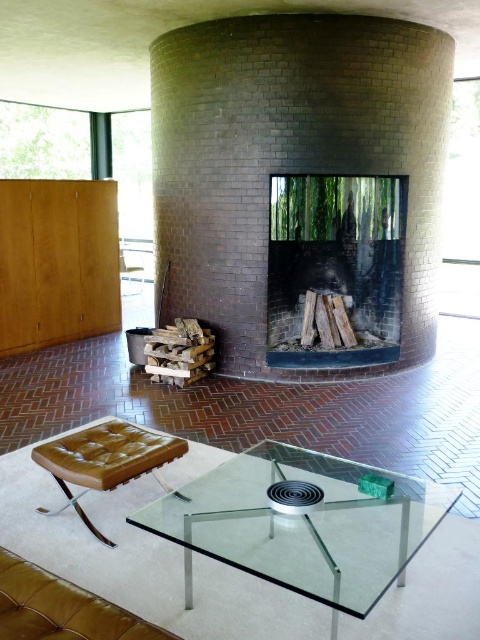
Can you confirm if transparent glass table at center is positioned below brown leather ottoman at center?

Indeed, transparent glass table at center is positioned under brown leather ottoman at center.

Is transparent glass table at center to the left of brown leather ottoman at center from the viewer's perspective?

In fact, transparent glass table at center is to the right of brown leather ottoman at center.

Image resolution: width=480 pixels, height=640 pixels. I want to click on transparent glass table at center, so click(302, 525).

Is brown leather ottoman at center further to camera compared to brown leather armchair at center?

That is False.

Identify the location of brown leather ottoman at center. (106, 461).

Where is `brown leather ottoman at center`? This screenshot has height=640, width=480. brown leather ottoman at center is located at coordinates (106, 461).

Image resolution: width=480 pixels, height=640 pixels. Identify the location of brick fireplace at center. (290, 154).

Is brick fireplace at center below transparent glass table at center?

Incorrect, brick fireplace at center is not positioned below transparent glass table at center.

Measure the distance between brick fireplace at center and camera.

A distance of 4.42 meters exists between brick fireplace at center and camera.

Where is `brick fireplace at center`? The image size is (480, 640). brick fireplace at center is located at coordinates (290, 154).